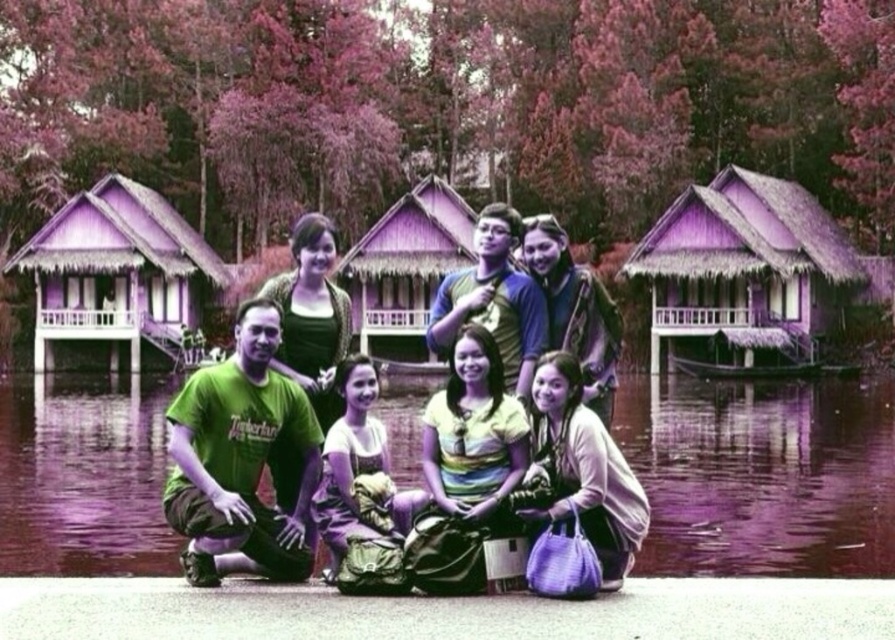
Question: Is green fabric people at center in front of purple fabric bag at lower right?

Choices:
 (A) yes
 (B) no

Answer: (B)

Question: Does green fabric people at center have a lesser width compared to purple wooden hut at left?

Choices:
 (A) yes
 (B) no

Answer: (B)

Question: Which object is closer to the camera taking this photo?

Choices:
 (A) purple wooden hut at right
 (B) green fabric people at center
 (C) purple fabric bag at lower right

Answer: (C)

Question: Considering the relative positions of purple wooden hut at right and green matte shirt at center in the image provided, where is purple wooden hut at right located with respect to green matte shirt at center?

Choices:
 (A) right
 (B) left

Answer: (A)

Question: Based on their relative distances, which object is farther from the green fabric shirt at center?

Choices:
 (A) green matte shirt at center
 (B) green fabric people at center

Answer: (B)

Question: Which point is closer to the camera taking this photo?

Choices:
 (A) (781, 202)
 (B) (329, 563)
 (C) (589, 483)

Answer: (C)